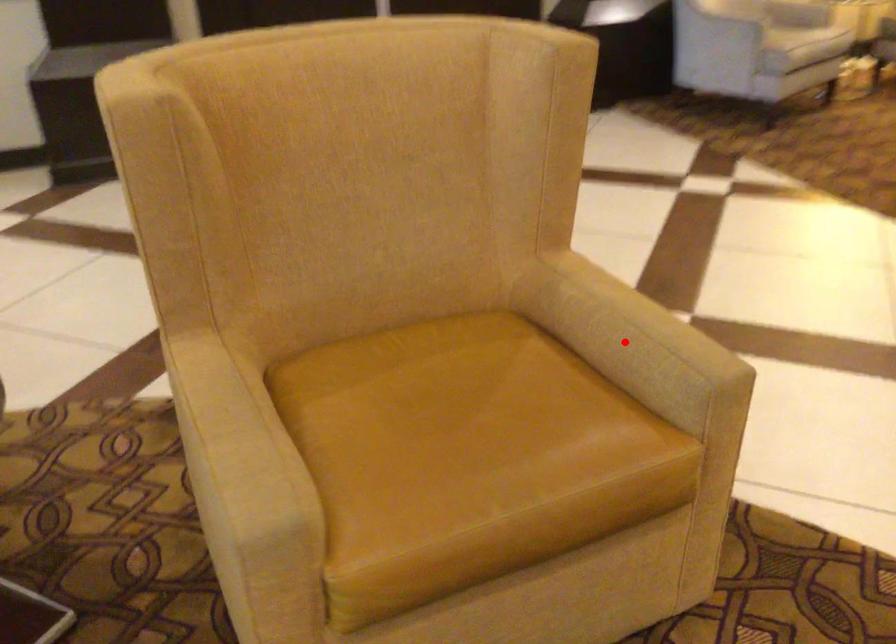
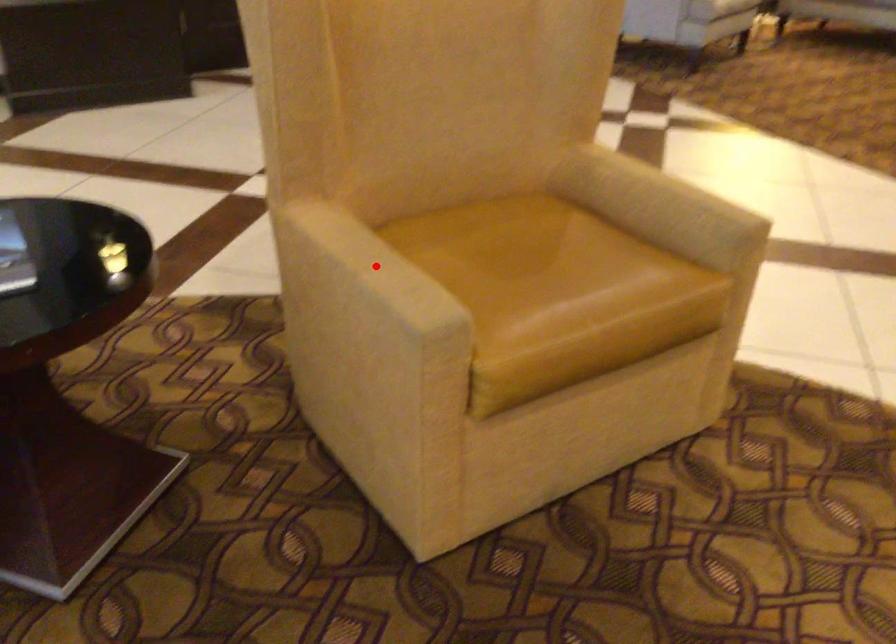
I am providing you with two images of the same scene from different viewpoints. A red point is marked on the first image and another point is marked on the second image. Is the red point in image1 aligned with the point shown in image2?

No